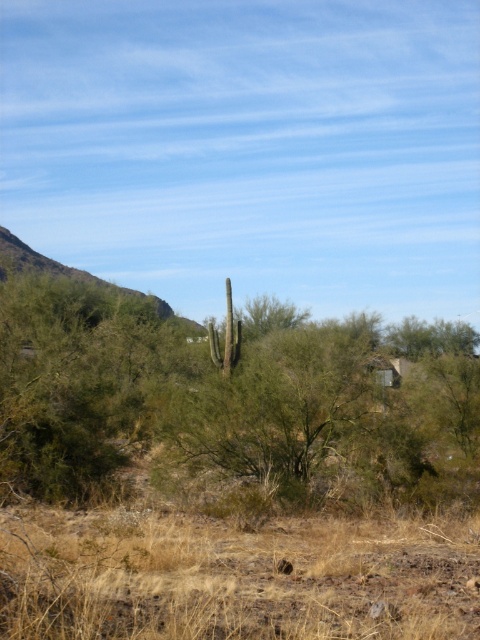
Question: Which point is closer to the camera?

Choices:
 (A) green leafy tree at center
 (B) brown dry grass at center

Answer: (B)

Question: Does green leafy tree at center have a larger size compared to brown dry grass at center?

Choices:
 (A) no
 (B) yes

Answer: (B)

Question: From the image, what is the correct spatial relationship of green leafy tree at center in relation to brown dry grass at center?

Choices:
 (A) above
 (B) below

Answer: (A)

Question: Is green leafy tree at center smaller than brown dry grass at center?

Choices:
 (A) yes
 (B) no

Answer: (B)

Question: Which of the following is the farthest from the observer?

Choices:
 (A) green leafy tree at center
 (B) brown dry grass at center

Answer: (A)